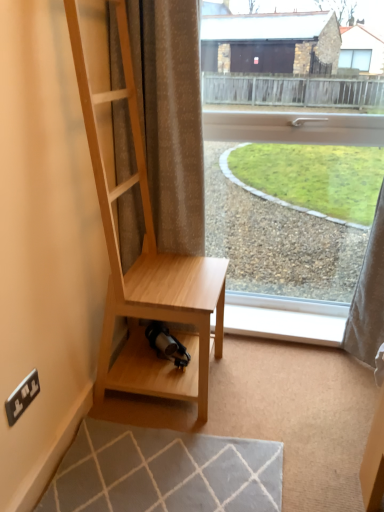
Question: In terms of width, does transparent glass window at center look wider or thinner when compared to white plastic electric outlet at lower left?

Choices:
 (A) wide
 (B) thin

Answer: (A)

Question: Considering the positions of point (269, 232) and point (6, 415), is point (269, 232) closer or farther from the camera than point (6, 415)?

Choices:
 (A) farther
 (B) closer

Answer: (A)

Question: Considering the real-world distances, which object is farthest from the light wood shelf at center?

Choices:
 (A) white plastic electric outlet at lower left
 (B) transparent glass window at center
 (C) beige textured curtain at center
 (D) white plastic window sill at lower center

Answer: (B)

Question: Estimate the real-world distances between objects in this image. Which object is farther from the white plastic electric outlet at lower left?

Choices:
 (A) beige textured curtain at center
 (B) light wood shelf at center
 (C) white plastic window sill at lower center
 (D) transparent glass window at center

Answer: (D)